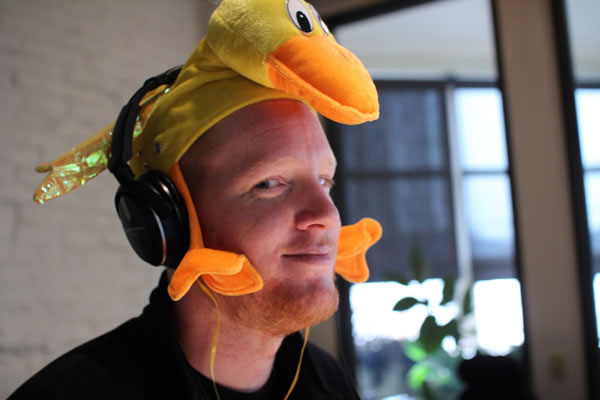
The image size is (600, 400). Identify the location of green leafed plant. (428, 335).